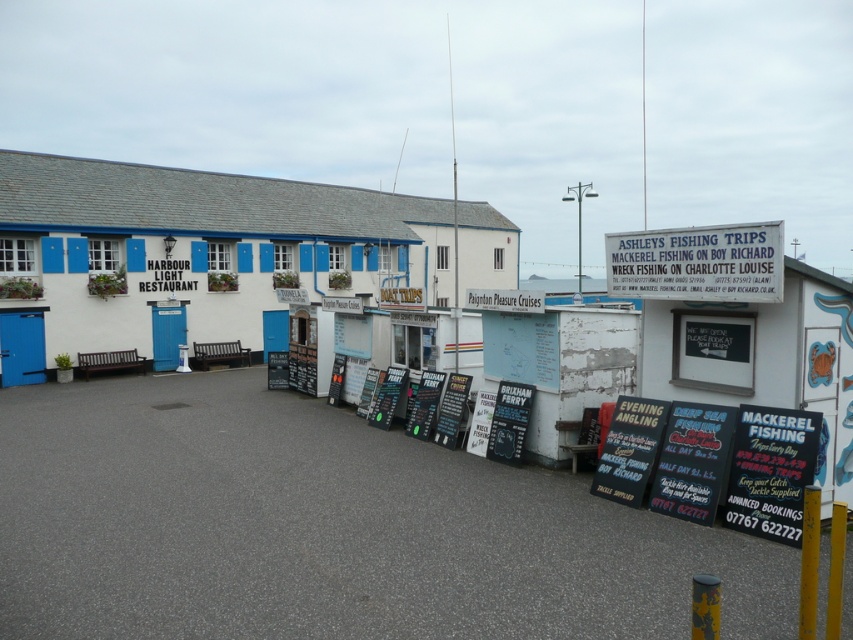
Is white painted signboard at upper right thinner than black plastic sign at center?

In fact, white painted signboard at upper right might be wider than black plastic sign at center.

Does point (671, 243) come behind point (527, 417)?

No.

Between point (753, 282) and point (518, 419), which one is positioned in front?

Point (753, 282) is in front.

The width and height of the screenshot is (853, 640). Identify the location of white painted signboard at upper right. (x=698, y=262).

Does point (752, 422) lie behind point (497, 429)?

No.

Is black plastic signboard at lower right bigger than black plastic sign at center?

Yes, black plastic signboard at lower right is bigger than black plastic sign at center.

Is point (763, 492) in front of point (503, 433)?

Yes, point (763, 492) is in front of point (503, 433).

This screenshot has height=640, width=853. In order to click on black plastic signboard at lower right in this screenshot , I will do `click(770, 472)`.

Does point (778, 244) come farther from viewer compared to point (786, 506)?

No.

In the scene shown: Which is more to the left, white painted signboard at upper right or black plastic signboard at lower right?

black plastic signboard at lower right

Does point (637, 275) lie behind point (775, 516)?

Yes.

You are a GUI agent. You are given a task and a screenshot of the screen. Output one action in this format:
    pyautogui.click(x=<x>, y=<y>)
    Task: Click on the white painted signboard at upper right
    This screenshot has width=853, height=640.
    Given the screenshot: What is the action you would take?
    pyautogui.click(x=698, y=262)